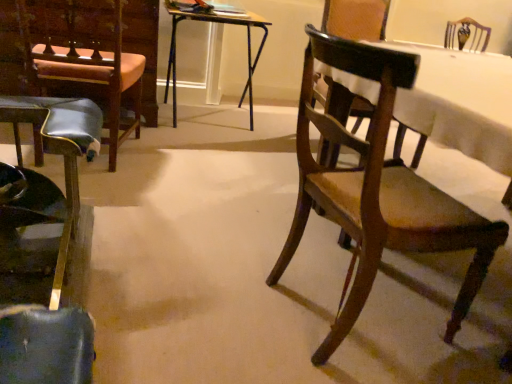
Image resolution: width=512 pixels, height=384 pixels. I want to click on vacant space underneath wooden folding table at center (from a real-world perspective), so click(x=212, y=122).